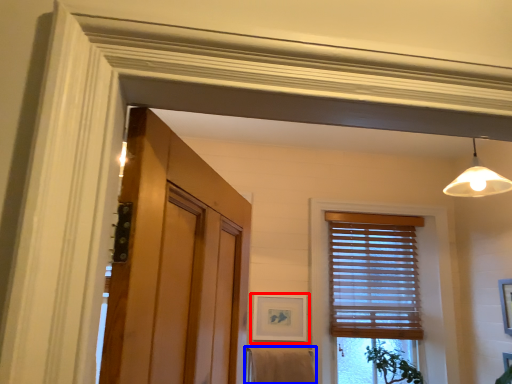
Question: Which of the following is the farthest to the observer, picture frame (highlighted by a red box) or bath towel (highlighted by a blue box)?

Choices:
 (A) picture frame
 (B) bath towel

Answer: (A)